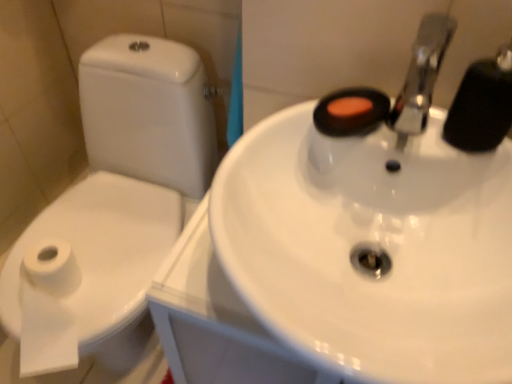
Question: Considering the positions of white glossy sink at center and white paper bidet at left in the image, is white glossy sink at center bigger or smaller than white paper bidet at left?

Choices:
 (A) small
 (B) big

Answer: (B)

Question: From their relative heights in the image, would you say white glossy sink at center is taller or shorter than white paper bidet at left?

Choices:
 (A) short
 (B) tall

Answer: (B)

Question: Which of these objects is positioned farthest from the white glossy sink at center?

Choices:
 (A) white paper bidet at left
 (B) black rubber faucet at upper right

Answer: (A)

Question: Which is farther from the black rubber faucet at upper right?

Choices:
 (A) white paper bidet at left
 (B) white glossy sink at center

Answer: (A)